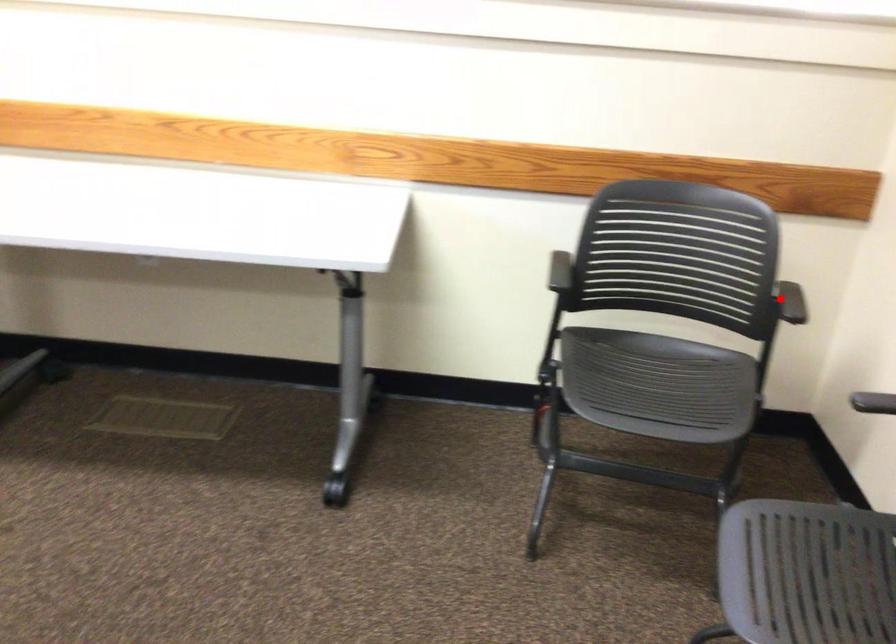
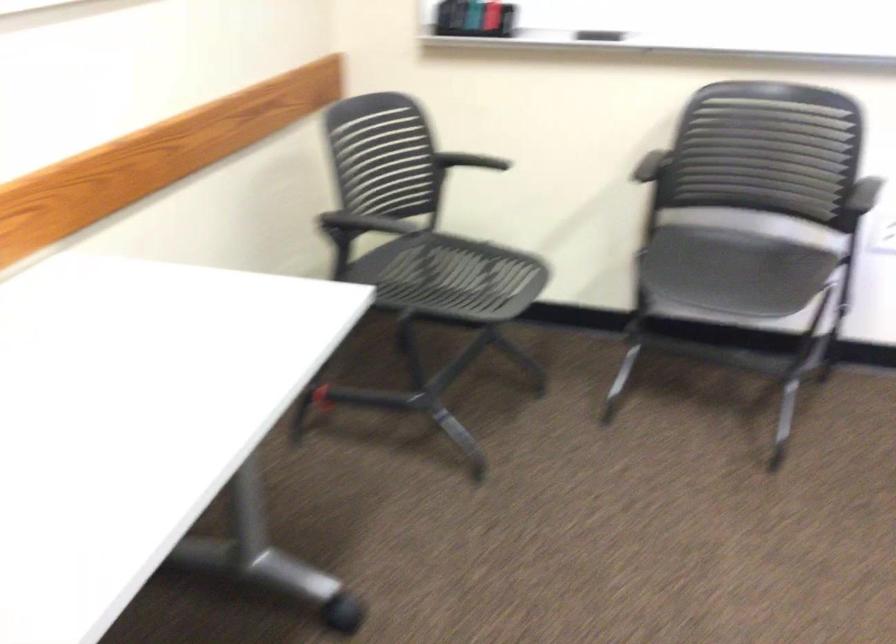
Question: I am providing you with two images of the same scene from different viewpoints. In image1, a red point is highlighted. Considering the same 3D point in image2, which of the following is correct?

Choices:
 (A) It is closer
 (B) It is farther

Answer: (B)